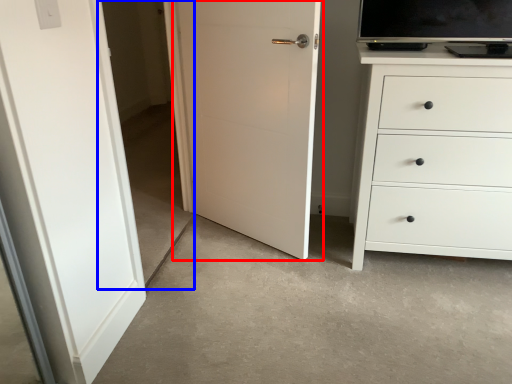
Question: Which object is closer to the camera taking this photo, door (highlighted by a red box) or glass door (highlighted by a blue box)?

Choices:
 (A) door
 (B) glass door

Answer: (B)